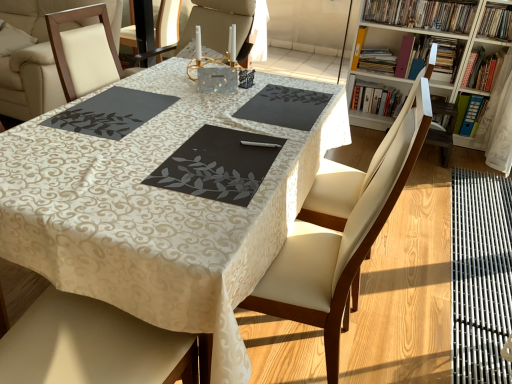
What are the coordinates of `free space between dark gray matte placemat at center, the third place mat positioned from the right, and black matte place mat at center, the second place mat from the left` in the screenshot? It's located at (168, 134).